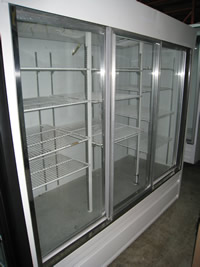
Find the location of `back wall of fridge`. back wall of fridge is located at coordinates (69, 118).